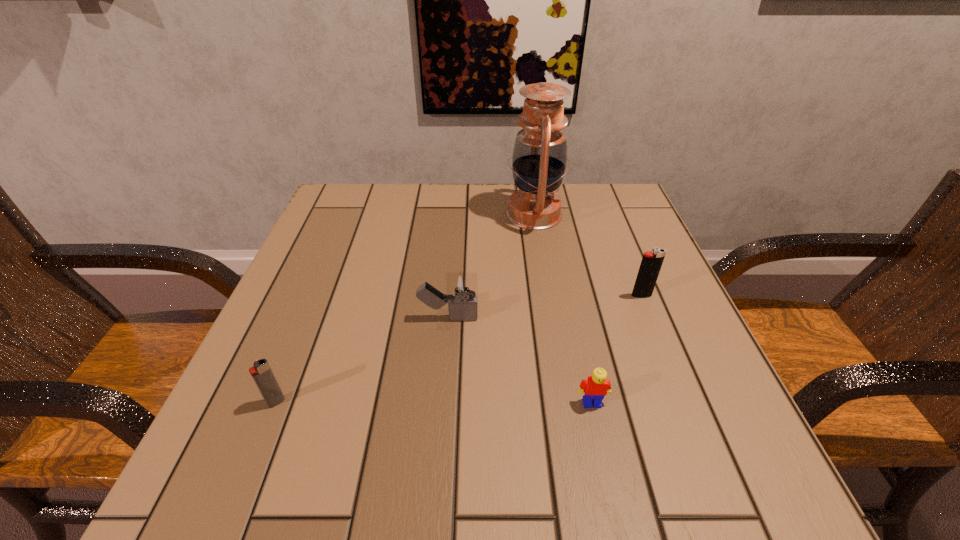
Identify the location of blank space located on the back of the rightmost object. (599, 191).

The width and height of the screenshot is (960, 540). Identify the location of free space located 0.220m on the right of the second nearest igniter. (596, 318).

Find the location of `vacant space located 0.270m on the back of the leftmost igniter`. vacant space located 0.270m on the back of the leftmost igniter is located at coordinates point(324,282).

The height and width of the screenshot is (540, 960). I want to click on free space located on the front-facing side of the shortest object, so click(x=600, y=439).

I want to click on object positioned at the far edge, so click(x=539, y=158).

The image size is (960, 540). I want to click on object positioned at the left edge, so click(261, 372).

The image size is (960, 540). Identify the location of object that is at the right edge. (651, 263).

Find the location of a particular element. The height and width of the screenshot is (540, 960). vacant area at the far edge is located at coordinates (452, 190).

You are a GUI agent. You are given a task and a screenshot of the screen. Output one action in this format:
    pyautogui.click(x=<x>, y=<y>)
    Task: Click on the vacant region at the near edge of the desktop
    Image resolution: width=960 pixels, height=540 pixels.
    Given the screenshot: What is the action you would take?
    pyautogui.click(x=417, y=484)

Where is `vacant space at the left edge of the desktop`? vacant space at the left edge of the desktop is located at coordinates (297, 334).